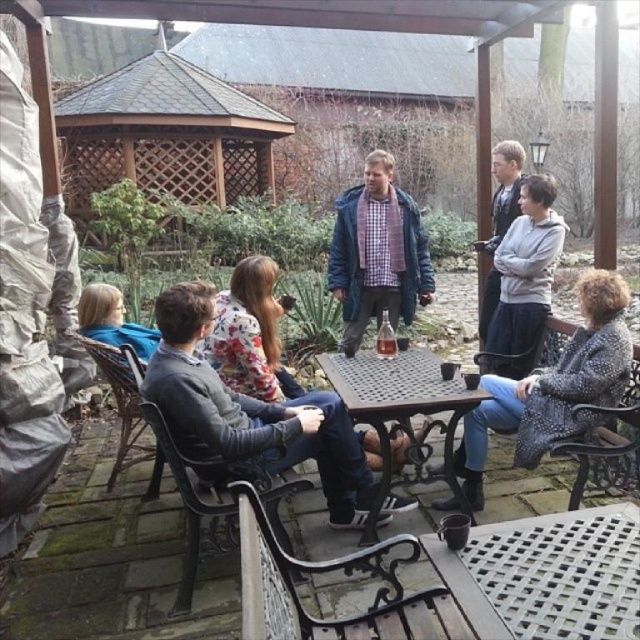
Question: Which object is positioned farthest from the metallic brown table at center?

Choices:
 (A) checkered fabric shirt at center
 (B) gray fabric jacket at center
 (C) light gray sweatshirt at upper right

Answer: (A)

Question: Which point is closer to the camera?

Choices:
 (A) patterned fabric coat at lower right
 (B) light brown hair at lower left
 (C) brown wooden gazebo at upper left

Answer: (A)

Question: Can you confirm if gray fabric jacket at center is positioned to the right of light brown hair at lower left?

Choices:
 (A) yes
 (B) no

Answer: (A)

Question: Is checkered fabric shirt at center above metallic brown table at center?

Choices:
 (A) no
 (B) yes

Answer: (B)

Question: Which object is the farthest from the gray fabric jacket at center?

Choices:
 (A) light gray sweatshirt at upper right
 (B) checkered fabric shirt at center
 (C) light brown hair at lower left

Answer: (B)

Question: Does brown wooden gazebo at upper left appear on the left side of patterned fabric coat at lower right?

Choices:
 (A) yes
 (B) no

Answer: (A)